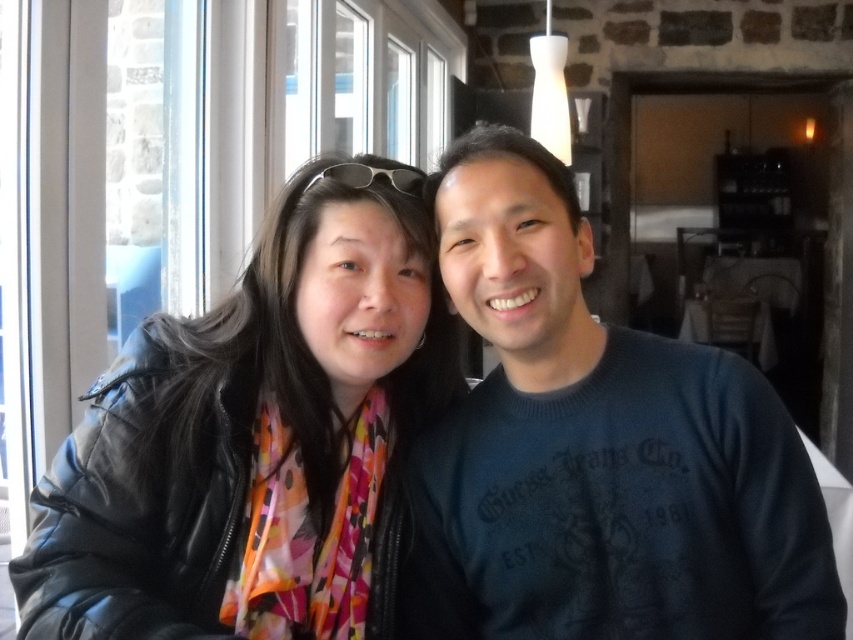
You are a photographer trying to capture a closeup of the sunglasses at center without including the dark blue sweater at center in the frame. Based on their sizes, is this possible?

The dark blue sweater at center is wider than the sunglasses at center. Since the sweater is larger in width, it might be challenging to frame the sunglasses without including part of the sweater, depending on the camera angle and distance.

You are a photographer trying to capture a group photo of the two people in the scene. Since you want to ensure both the matte black jacket at center and the dark blue sweater at center are clearly visible in the frame, which clothing item should you focus on to avoid blurring due to their positions?

The matte black jacket at center is wider than the dark blue sweater at center, so focusing on the matte black jacket at center would ensure both are in focus as it is the wider item.

You are standing in a cafe and want to place a small plant pot that is 0.5 meters wide between the two people. The point where you want to place it is at coordinates point (x=312, y=616). Can you fit the plant pot there without it overlapping the people?

The distance between point (x=312, y=616) and the viewer is 1.05 meters. Since the plant pot is only 0.5 meters wide, there is enough space to place it there without overlapping the people.